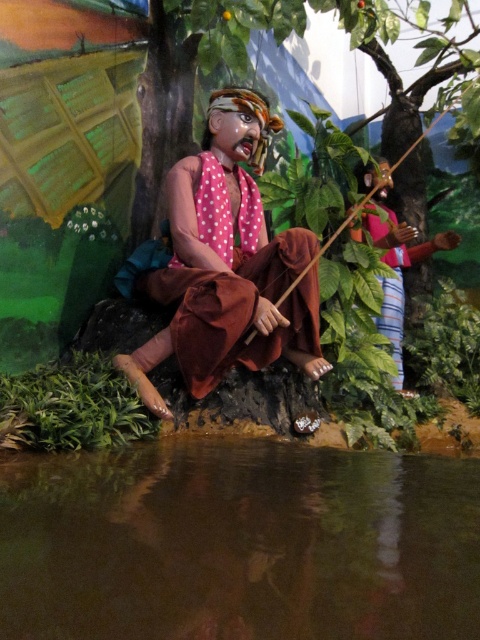
In the scene shown: You are a photographer trying to capture the scene from the front. You notice the transparent liquid water at lower center and the polka dot fabric shirt at upper right. Which object is shorter in height?

The transparent liquid water at lower center is not as tall as the polka dot fabric shirt at upper right, so the transparent liquid water at lower center is shorter in height.

You are a photographer trying to capture both the transparent liquid water at lower center and the polka dot fabric shirt at upper right in a single shot. Based on their positions, which object is wider from your viewpoint?

The transparent liquid water at lower center might be wider than the polka dot fabric shirt at upper right, so it is wider from your viewpoint.